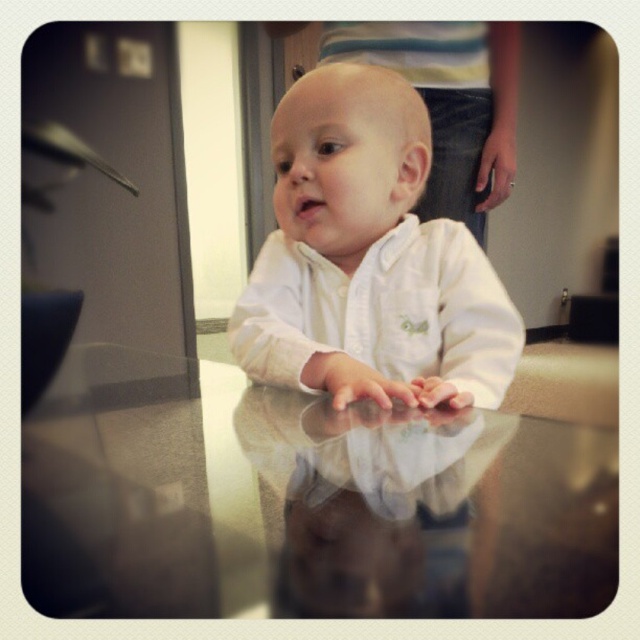
Question: Is transparent glass table at center closer to the viewer compared to white matte hand at center?

Choices:
 (A) yes
 (B) no

Answer: (A)

Question: Which of the following is the closest to the observer?

Choices:
 (A) (432, 378)
 (B) (308, 403)
 (C) (248, 420)

Answer: (C)

Question: Which of the following is the closest to the observer?

Choices:
 (A) white glossy hands at center
 (B) white matte shirt at center
 (C) pink flesh at center
 (D) transparent glass table at center

Answer: (D)

Question: Is transparent glass table at center to the left of pink flesh at center from the viewer's perspective?

Choices:
 (A) no
 (B) yes

Answer: (B)

Question: Which of the following is the closest to the observer?

Choices:
 (A) (410, 404)
 (B) (436, 396)
 (C) (237, 604)
 (D) (417, 512)

Answer: (C)

Question: Does white matte shirt at center lie in front of white glossy hands at center?

Choices:
 (A) no
 (B) yes

Answer: (A)